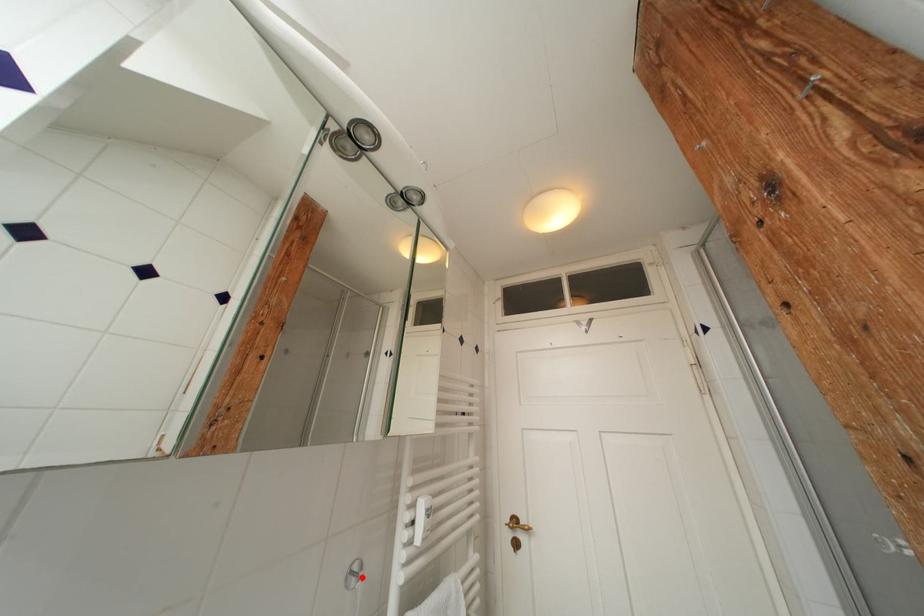
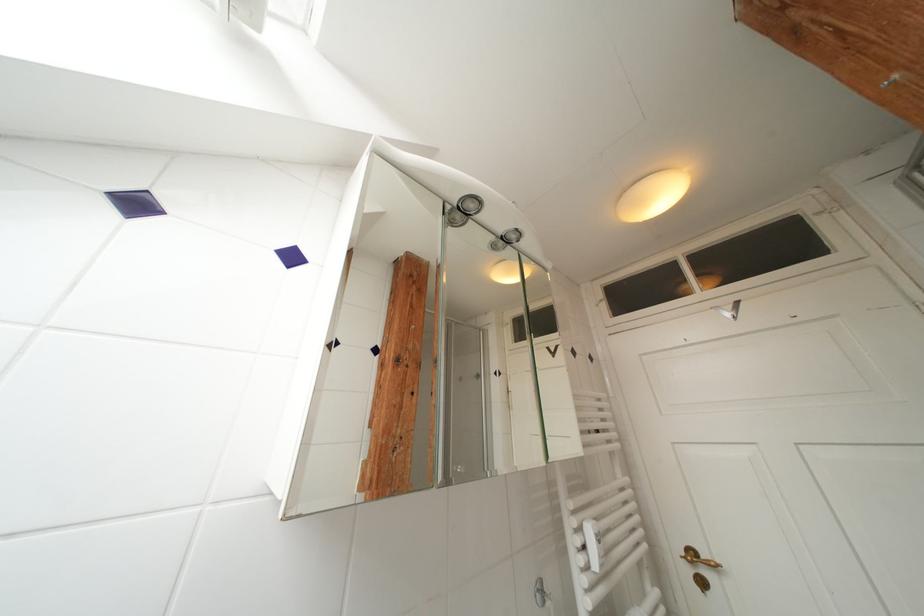
Find the pixel in the second image that matches the highlighted location in the first image.

(548, 594)